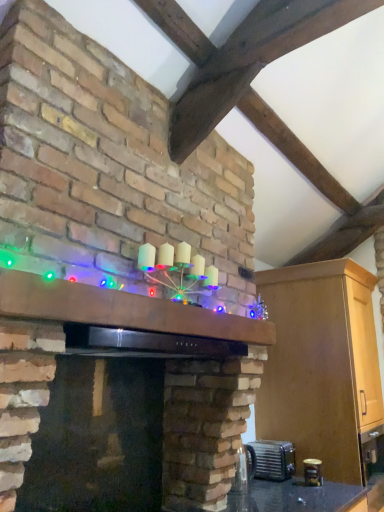
Question: Is illuminated wooden mantle at center outside matte brick fireplace at center?

Choices:
 (A) yes
 (B) no

Answer: (B)

Question: From the image's perspective, is illuminated wooden mantle at center under matte brick fireplace at center?

Choices:
 (A) yes
 (B) no

Answer: (A)

Question: Is illuminated wooden mantle at center oriented towards matte brick fireplace at center?

Choices:
 (A) no
 (B) yes

Answer: (B)

Question: From a real-world perspective, does illuminated wooden mantle at center stand above matte brick fireplace at center?

Choices:
 (A) yes
 (B) no

Answer: (B)

Question: Is illuminated wooden mantle at center behind matte brick fireplace at center?

Choices:
 (A) no
 (B) yes

Answer: (B)

Question: Is illuminated wooden mantle at center looking in the opposite direction of matte brick fireplace at center?

Choices:
 (A) no
 (B) yes

Answer: (B)

Question: Is matte brick fireplace at center at the right side of metallic silver toaster at lower right, placed as the second appliance when sorted from back to front?

Choices:
 (A) yes
 (B) no

Answer: (B)

Question: Considering the relative positions of matte brick fireplace at center and metallic silver toaster at lower right, the second appliance in the right-to-left sequence, in the image provided, is matte brick fireplace at center in front of metallic silver toaster at lower right, the second appliance in the right-to-left sequence,?

Choices:
 (A) yes
 (B) no

Answer: (A)

Question: Does matte brick fireplace at center have a greater height compared to metallic silver toaster at lower right, placed as the 1th appliance when sorted from left to right?

Choices:
 (A) no
 (B) yes

Answer: (B)

Question: Considering the relative positions of matte brick fireplace at center and metallic silver toaster at lower right, placed as the 1th appliance when sorted from left to right, in the image provided, is matte brick fireplace at center to the left of metallic silver toaster at lower right, placed as the 1th appliance when sorted from left to right, from the viewer's perspective?

Choices:
 (A) no
 (B) yes

Answer: (B)

Question: Could metallic silver toaster at lower right, placed as the 1th appliance when sorted from left to right, be considered to be inside matte brick fireplace at center?

Choices:
 (A) yes
 (B) no

Answer: (B)

Question: From the image's perspective, does matte brick fireplace at center appear lower than metallic silver toaster at lower right, the second appliance in the right-to-left sequence?

Choices:
 (A) yes
 (B) no

Answer: (B)

Question: Is metallic silver toaster at lower right, which appears as the 2th appliance when viewed from the front, bigger than illuminated wooden mantle at center?

Choices:
 (A) yes
 (B) no

Answer: (B)